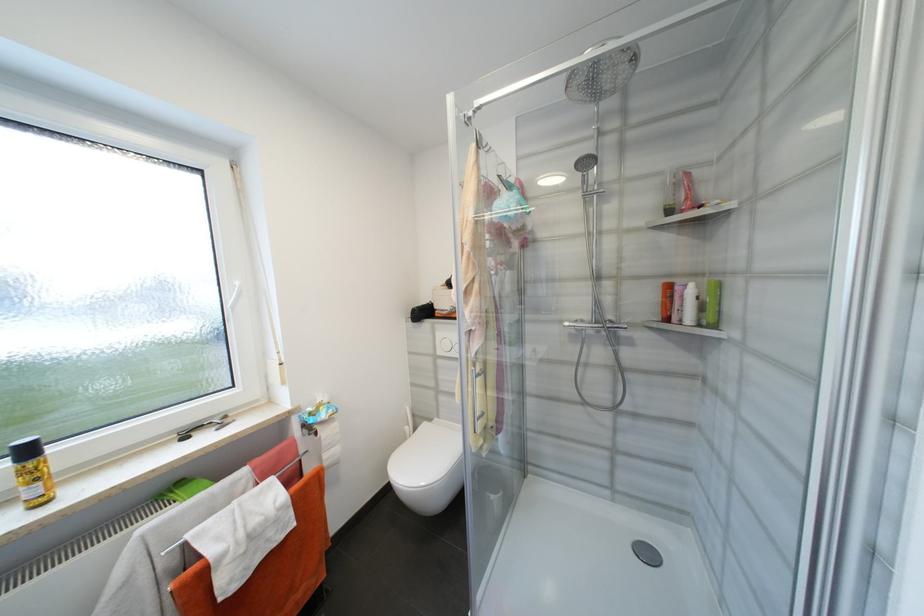
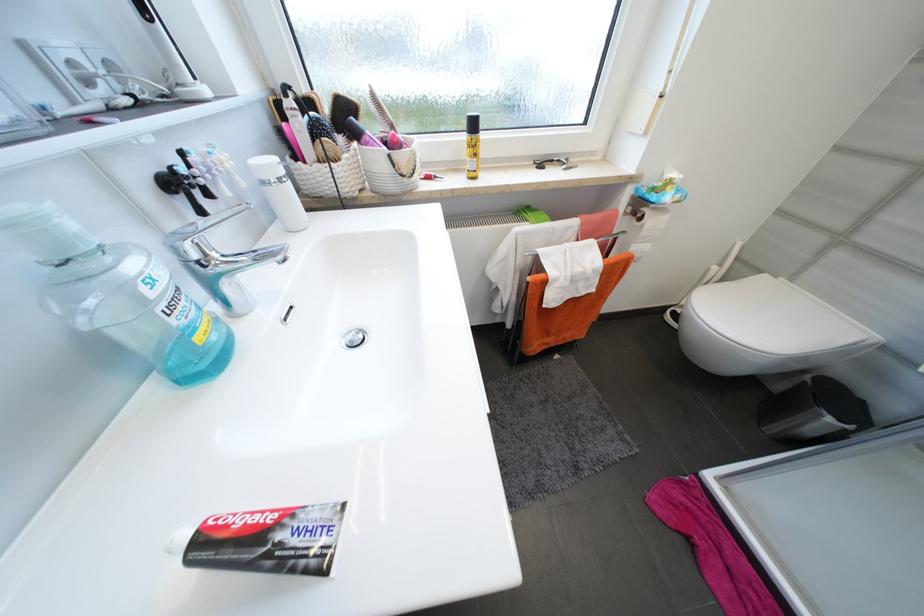
The point at [497,496] is marked in the first image. Where is the corresponding point in the second image?

(834, 421)